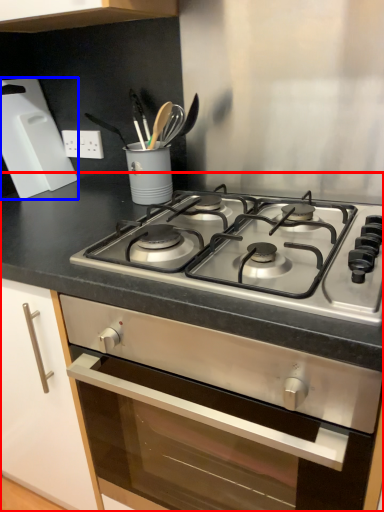
Question: Which object appears closest to the camera in this image, countertop (highlighted by a red box) or kitchen appliance (highlighted by a blue box)?

Choices:
 (A) countertop
 (B) kitchen appliance

Answer: (A)